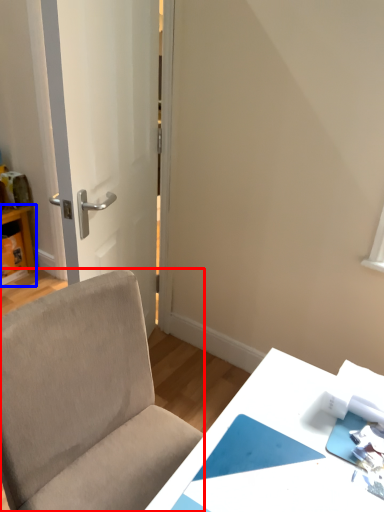
Question: Among these objects, which one is farthest to the camera, chair (highlighted by a red box) or table (highlighted by a blue box)?

Choices:
 (A) chair
 (B) table

Answer: (B)